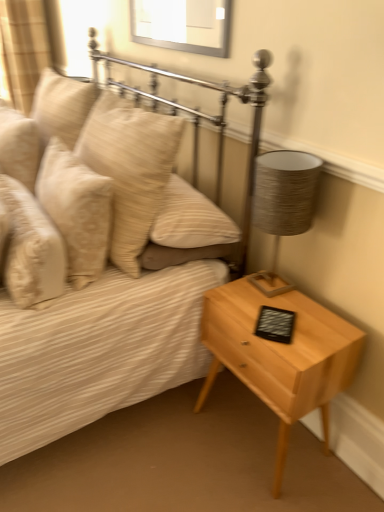
At what (x,y) coordinates should I click in order to perform the action: click on free point below textured gray lampshade at right (from a real-world perspective). Please return your answer as a coordinate pair (x, y). Looking at the image, I should click on (265, 288).